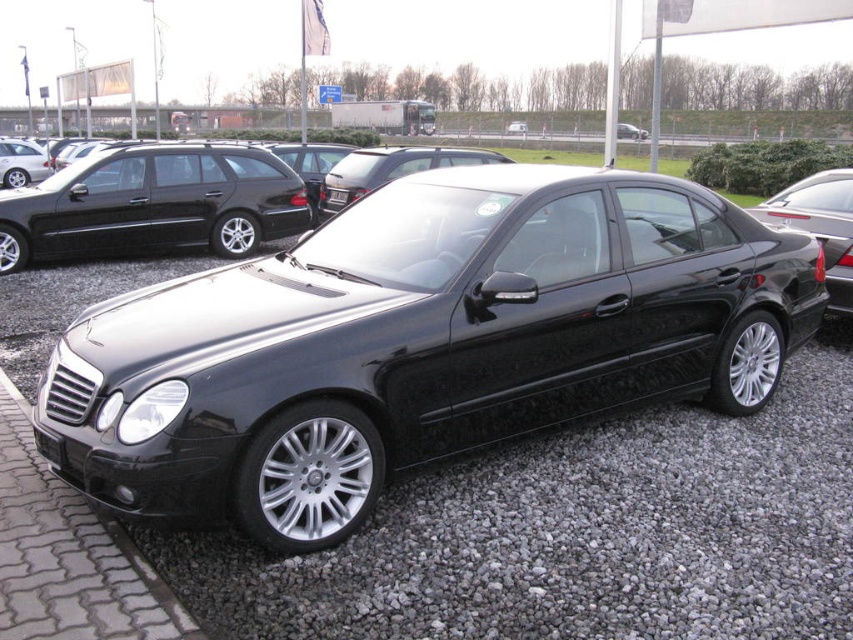
Question: Can you confirm if glossy black car at center is wider than cobblestone at lower left?

Choices:
 (A) yes
 (B) no

Answer: (A)

Question: Can you confirm if cobblestone at lower left is positioned to the left of black metallic license plate at center?

Choices:
 (A) no
 (B) yes

Answer: (B)

Question: Which object is farther from the camera taking this photo?

Choices:
 (A) matte black sedan at left
 (B) glossy black sedan at right
 (C) cobblestone at lower left
 (D) glossy black car at center

Answer: (A)

Question: Which is nearer to the glossy black car at center?

Choices:
 (A) glossy black sedan at right
 (B) matte black sedan at left
 (C) cobblestone at lower left

Answer: (C)

Question: Among these objects, which one is nearest to the camera?

Choices:
 (A) black metallic license plate at center
 (B) cobblestone at lower left
 (C) gray gravel at lower center

Answer: (B)

Question: Is gray gravel at lower center to the right of glossy black sedan at right from the viewer's perspective?

Choices:
 (A) yes
 (B) no

Answer: (B)